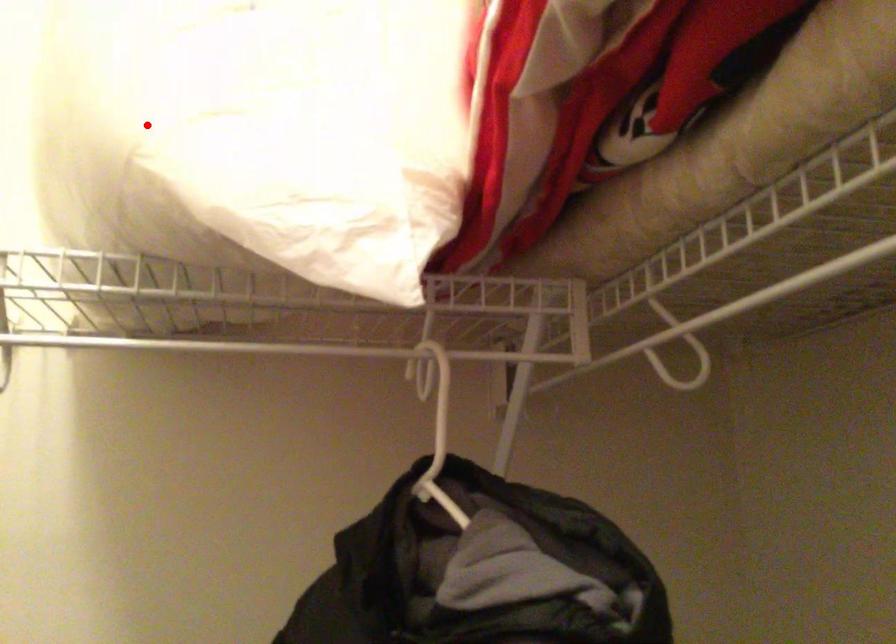
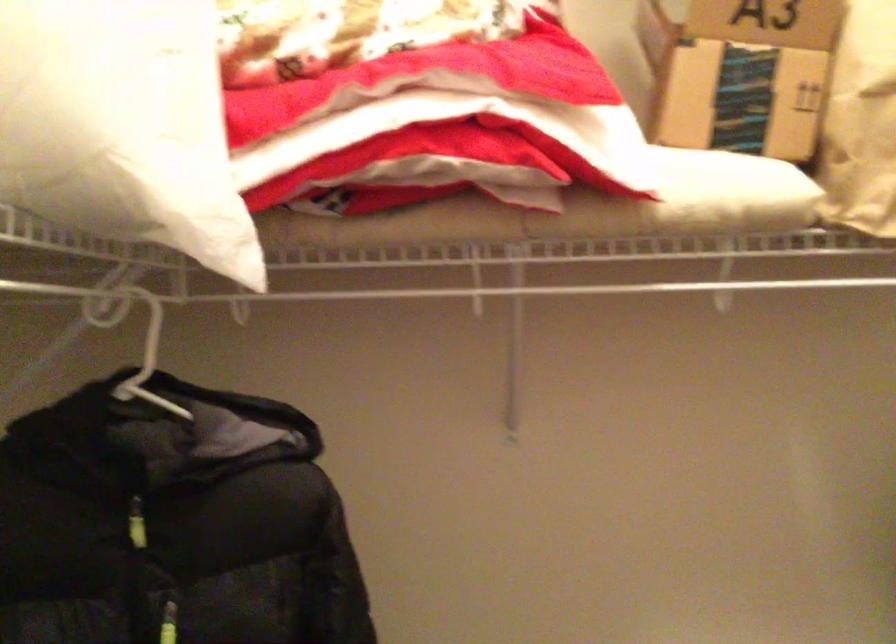
Question: I am providing you with two images of the same scene from different viewpoints. Image1 has a red point marked. In image2, the corresponding 3D location appears at what relative position? Reply with the corresponding letter.

Choices:
 (A) Closer
 (B) Farther

Answer: (B)